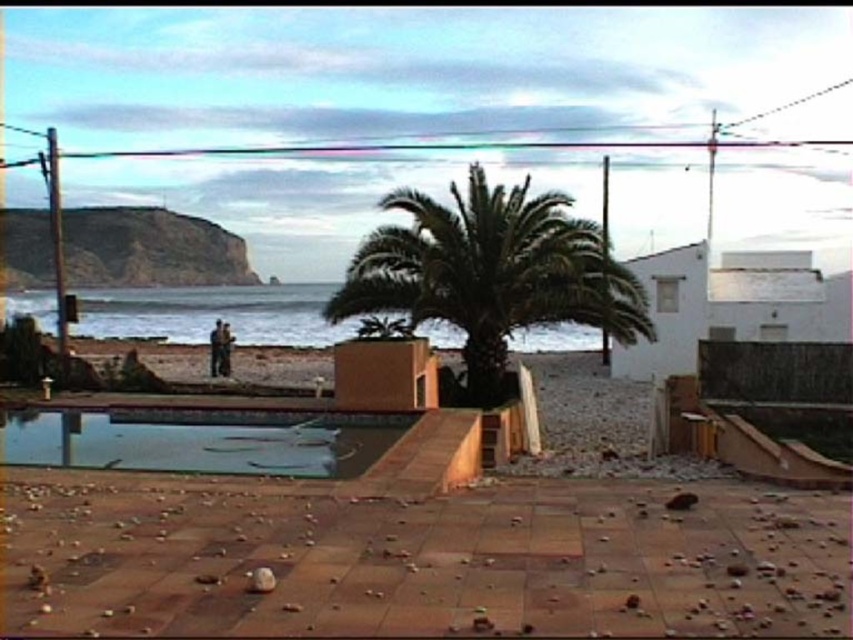
Question: Does green leafy palm tree at center appear under transparent glass pool at center?

Choices:
 (A) yes
 (B) no

Answer: (B)

Question: Which point is farther to the camera?

Choices:
 (A) (590, 260)
 (B) (247, 412)

Answer: (A)

Question: Is green leafy palm tree at center positioned behind transparent glass pool at center?

Choices:
 (A) yes
 (B) no

Answer: (A)

Question: Where is green leafy palm tree at center located in relation to transparent glass pool at center in the image?

Choices:
 (A) below
 (B) above

Answer: (B)